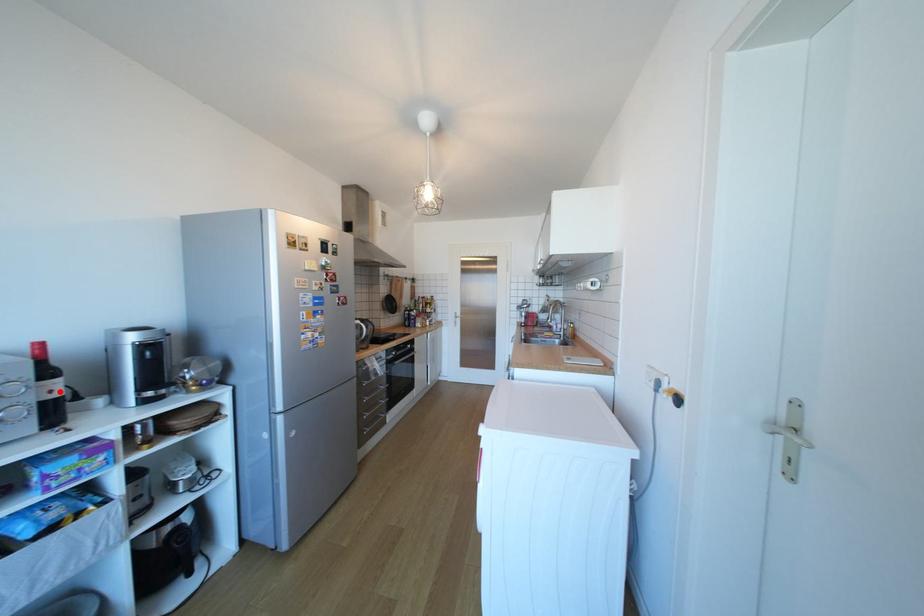
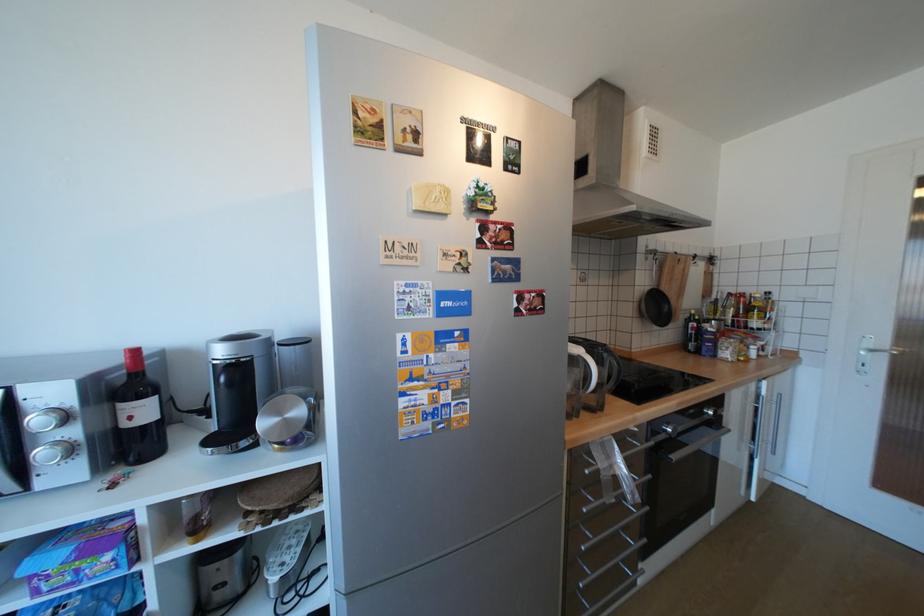
In the second image, find the point that corresponds to the highlighted location in the first image.

(140, 418)